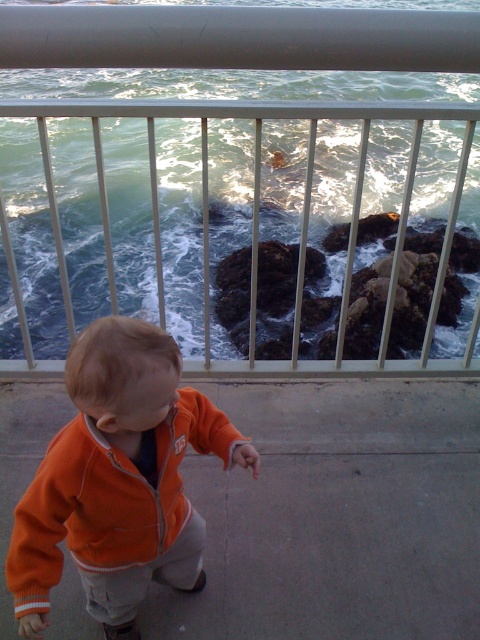
Does metallic silver railing at upper center have a smaller size compared to orange fleece jacket at lower left?

No.

The image size is (480, 640). What are the coordinates of `metallic silver railing at upper center` in the screenshot? It's located at (239, 38).